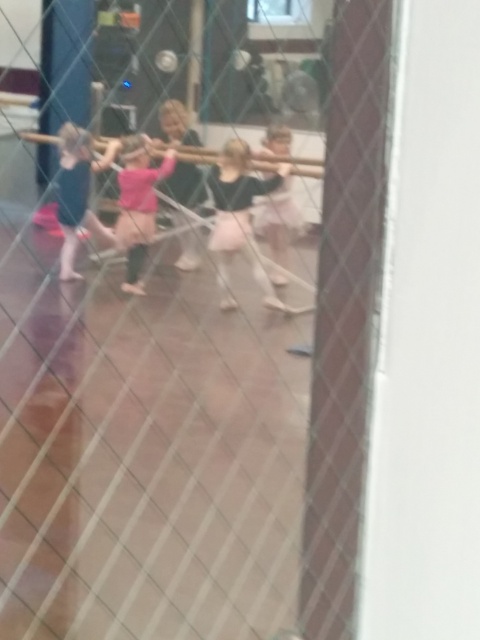
You are a photographer trying to capture a clear shot of the ballet class through the fence. You notice two ballet skirts in your viewfinder. The matte black ballet skirt at left and the pink satin ballet skirt at center. Which skirt is positioned higher in the frame?

The matte black ballet skirt at left is above the pink satin ballet skirt at center, so it is positioned higher in the frame.

You are a photographer positioned outside the dance studio, looking through the chain link fence. You want to take a clear photo of the pink matte dress at center and the matte black ballet skirt at left. Which object will appear larger in your photo?

The pink matte dress at center will appear larger in the photo because it is closer to the viewer than the matte black ballet skirt at left.